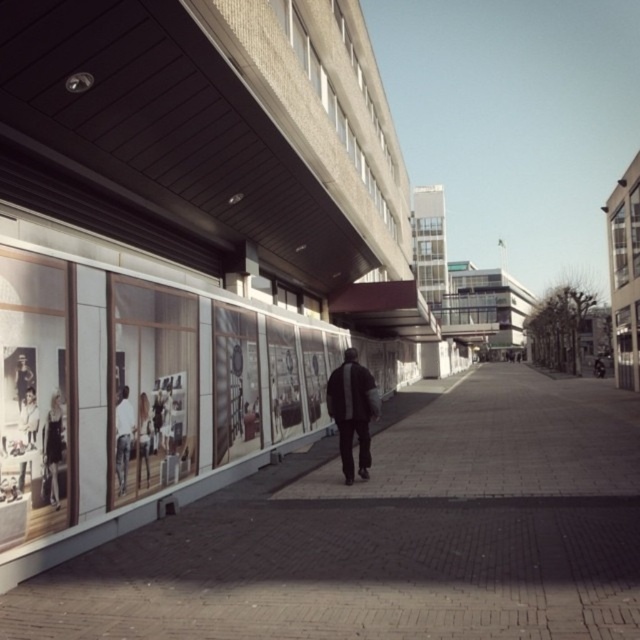
Question: Is matte black jacket at left positioned before white paper at lower left?

Choices:
 (A) no
 (B) yes

Answer: (A)

Question: Among these points, which one is nearest to the camera?

Choices:
 (A) (134, 424)
 (B) (148, 484)

Answer: (A)

Question: Is brick pavement at center wider than white paper at lower left?

Choices:
 (A) yes
 (B) no

Answer: (A)

Question: Can you confirm if matte black jacket at left is positioned above white paper at lower left?

Choices:
 (A) no
 (B) yes

Answer: (A)

Question: Which object is positioned farthest from the brick pavement at center?

Choices:
 (A) matte black jacket at left
 (B) matte black figure at lower left

Answer: (A)

Question: Estimate the real-world distances between objects in this image. Which object is farther from the white fabric at left?

Choices:
 (A) matte black figure at lower left
 (B) matte black jacket at left
 (C) dark gray fabric jacket at center
 (D) brick pavement at center

Answer: (D)